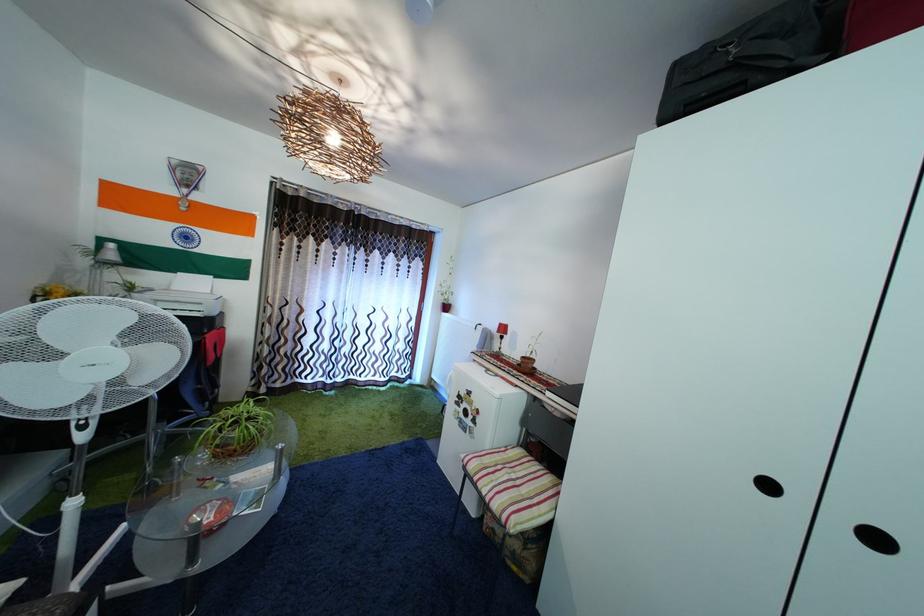
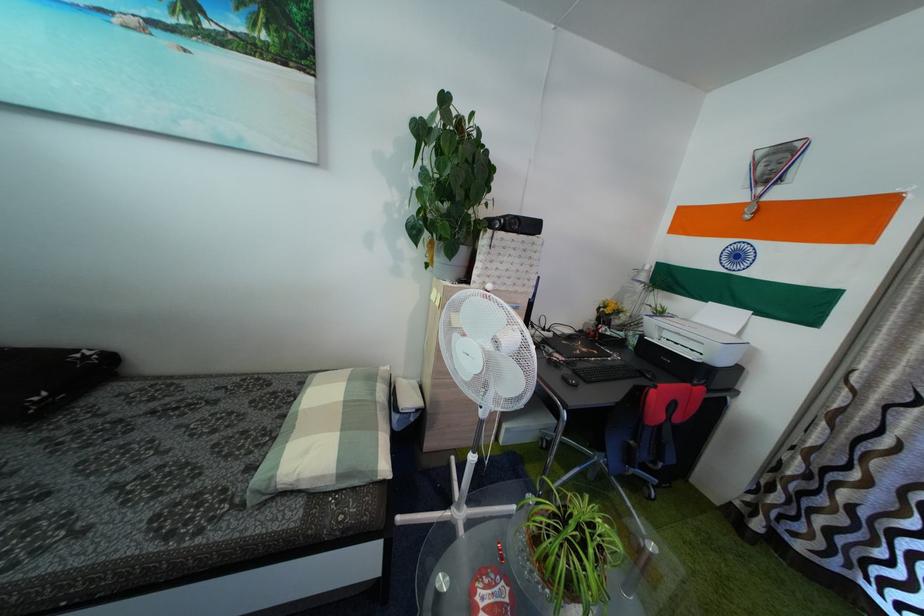
Locate, in the second image, the point that corresponds to point (184, 296) in the first image.

(703, 328)